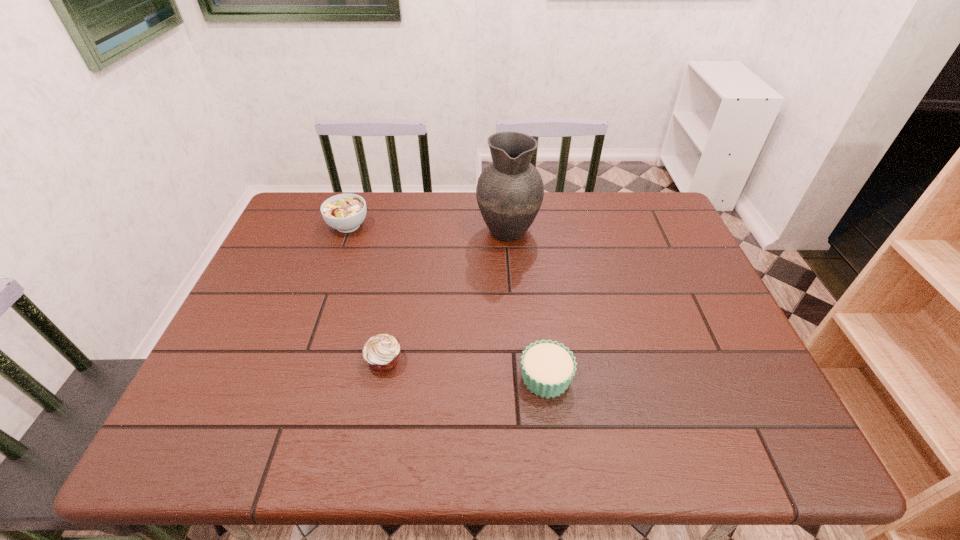
This screenshot has height=540, width=960. What are the coordinates of `free space between the cupcake and the muffin` in the screenshot? It's located at (465, 369).

Find the location of `free space between the muffin and the pitcher`. free space between the muffin and the pitcher is located at coordinates (445, 294).

You are a GUI agent. You are given a task and a screenshot of the screen. Output one action in this format:
    pyautogui.click(x=<x>, y=<y>)
    Task: Click on the free space that is in between the cupcake and the soup bowl
    The height and width of the screenshot is (540, 960).
    Given the screenshot: What is the action you would take?
    point(447,302)

Find the location of a particular element. Image resolution: width=960 pixels, height=540 pixels. free space that is in between the pitcher and the cupcake is located at coordinates (527, 303).

Find the location of a particular element. free space between the cupcake and the tallest object is located at coordinates (527, 303).

Where is `blank region between the cupcake and the muffin`? The width and height of the screenshot is (960, 540). blank region between the cupcake and the muffin is located at coordinates (465, 369).

Identify the location of free space between the soup bowl and the cupcake. The height and width of the screenshot is (540, 960). coord(447,302).

Where is `empty space between the second object from left to right and the pitcher`? empty space between the second object from left to right and the pitcher is located at coordinates (445, 294).

Where is `object that is the nearest to the pitcher`? This screenshot has height=540, width=960. object that is the nearest to the pitcher is located at coordinates (345, 212).

Image resolution: width=960 pixels, height=540 pixels. I want to click on object that is the third closest to the soup bowl, so click(x=548, y=367).